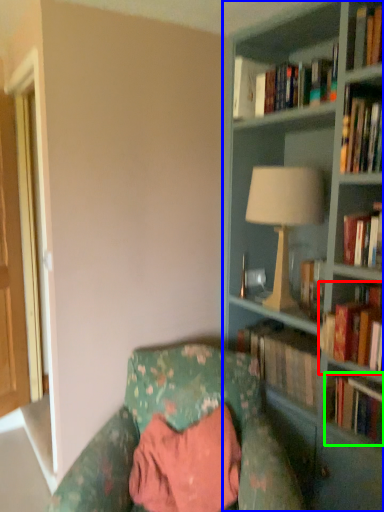
Question: Considering the real-world distances, which object is closest to book (highlighted by a red box)? bookcase (highlighted by a blue box) or book (highlighted by a green box).

Choices:
 (A) bookcase
 (B) book

Answer: (B)